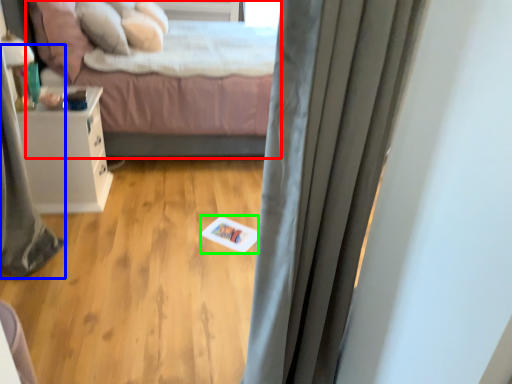
Question: Which object is positioned closest to bed (highlighted by a red box)? Select from shower curtain (highlighted by a blue box) and card (highlighted by a green box).

Choices:
 (A) shower curtain
 (B) card

Answer: (B)